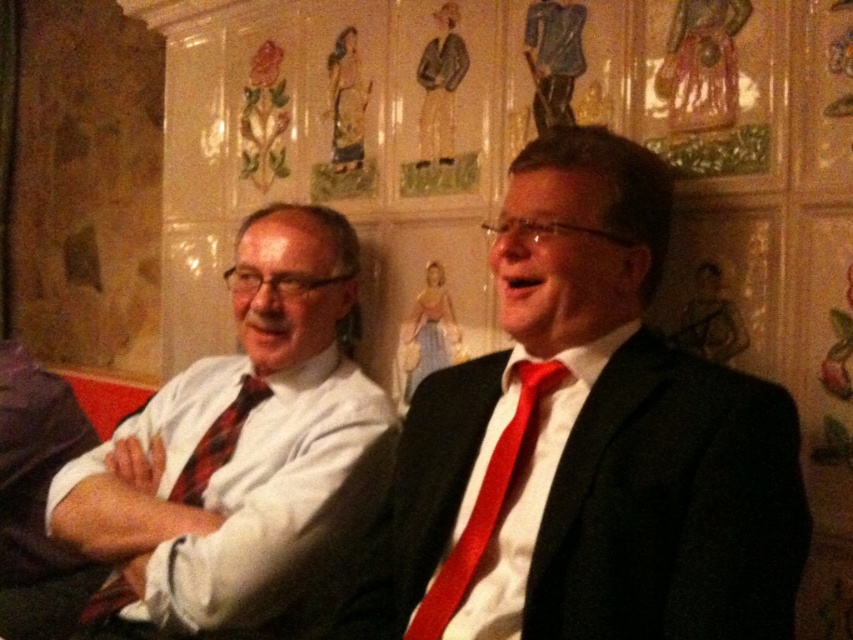
Question: Is matte black suit at center below matte red tie at left?

Choices:
 (A) yes
 (B) no

Answer: (B)

Question: Among these points, which one is nearest to the camera?

Choices:
 (A) (550, 244)
 (B) (195, 499)
 (C) (425, 616)
 (D) (216, 593)

Answer: (C)

Question: Which object appears farthest from the camera in this image?

Choices:
 (A) matte black suit at center
 (B) matte red tie at left
 (C) red satin tie at right
 (D) red plaid tie at left

Answer: (D)

Question: Which of the following is the farthest from the observer?

Choices:
 (A) (450, 557)
 (B) (450, 561)

Answer: (A)

Question: Does matte red tie at left lie in front of red plaid tie at left?

Choices:
 (A) yes
 (B) no

Answer: (A)

Question: Does matte red tie at left have a greater width compared to red satin tie at right?

Choices:
 (A) yes
 (B) no

Answer: (A)